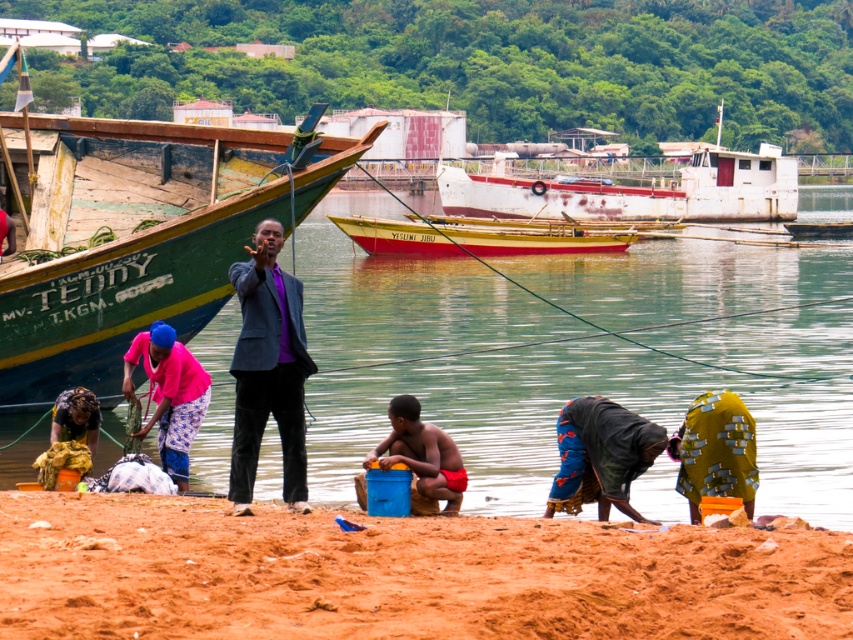
You are a photographer positioned at the point with coordinates point (601, 456). You want to capture a wide shot of the entire riverside scene. Which object from the scene should you focus on to ensure the blue fabric bag at lower center is centered in your photo?

The point (601, 456) corresponds to the blue fabric bag at lower center, so focusing on that object will center it in the photo.

You are planning to set up a picnic area for a family gathering. The picnic blanket you have is 2 meters wide. Based on the image, will the brown sandy beach at lower center be wide enough to accommodate your blanket without overlapping the green wooden boat at left?

The brown sandy beach at lower center is wider than the green wooden boat at left, so it should be wide enough to accommodate a 2 meter picnic blanket without overlapping the boat.